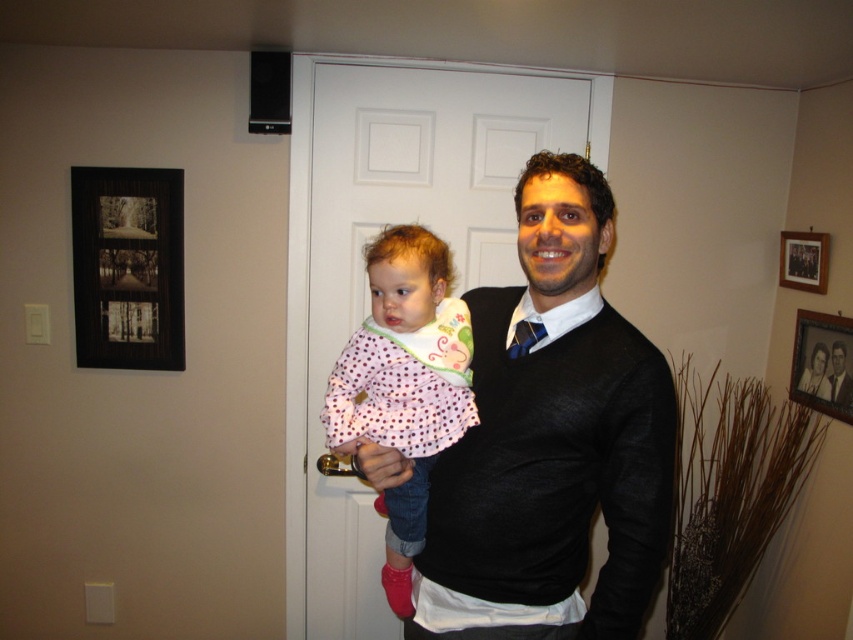
Between point (820, 388) and point (799, 236), which one is positioned behind?

The point (799, 236) is more distant.

Between point (830, 324) and point (805, 253), which one is positioned behind?

The point (805, 253) is more distant.

The width and height of the screenshot is (853, 640). In order to click on wooden framed photo at upper right in this screenshot , I will do `click(822, 364)`.

Can you confirm if black wood picture frame at upper left is positioned to the right of wooden picture frame at upper right?

No, black wood picture frame at upper left is not to the right of wooden picture frame at upper right.

Does black wood picture frame at upper left appear over wooden picture frame at upper right?

No, black wood picture frame at upper left is not above wooden picture frame at upper right.

Is point (70, 177) in front of point (816, 260)?

That is False.

Locate an element on the screen. black wood picture frame at upper left is located at coordinates (126, 268).

Does matte black sweater at center appear on the left side of black wood picture frame at upper left?

Incorrect, matte black sweater at center is not on the left side of black wood picture frame at upper left.

Find the location of a particular element. Image resolution: width=853 pixels, height=640 pixels. matte black sweater at center is located at coordinates (550, 440).

I want to click on matte black sweater at center, so click(x=550, y=440).